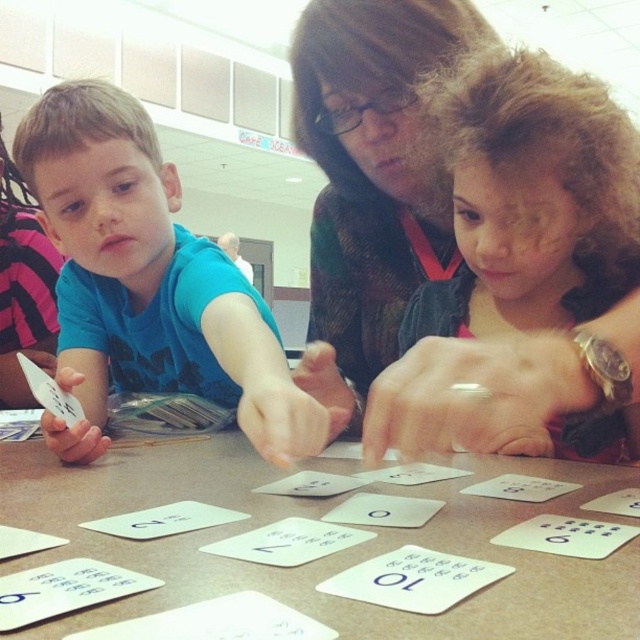
You are a participant in the activity and need to place a new card between the white paper cards at center and the curly brown hair at upper right. Based on their sizes, which object should the new card be closer to?

The white paper cards at center are shorter than the curly brown hair at upper right. Therefore, the new card should be placed closer to the white paper cards at center to maintain proportional spacing between objects of similar size.